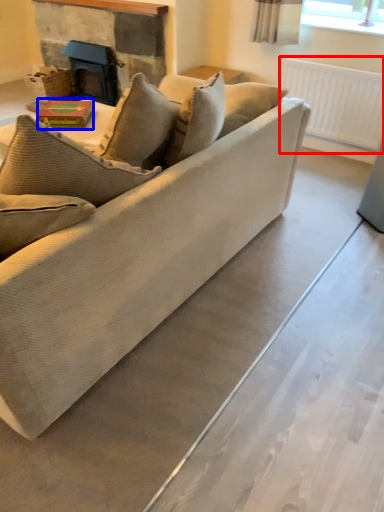
Question: Which object is further to the camera taking this photo, radiator (highlighted by a red box) or book (highlighted by a blue box)?

Choices:
 (A) radiator
 (B) book

Answer: (A)